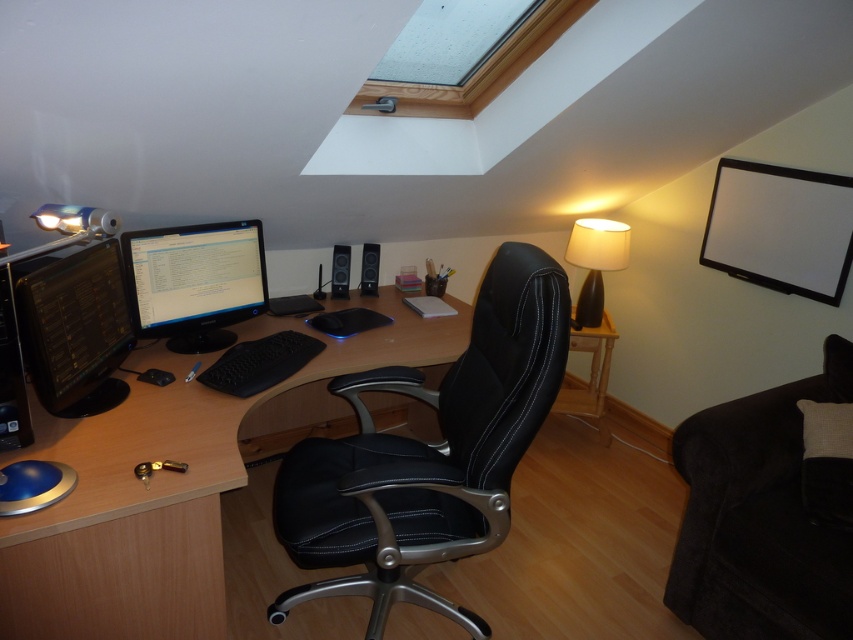
You are a delivery person who needs to place a package on the desk in the home office. The desk is at position 0.811, 0.891. Where should you place the package so that it is directly in front of the black leather swivel chair at center?

The package should be placed directly in front of the black leather swivel chair at center, which is located at position (759, 518). Since the chair is already at that coordinate, the package should be placed on the desk near the chair at that position.

You are standing in the loft office and need to place a new monitor on the woodendesk at center. According to the 2D coordinates provided, where exactly should you position it?

The woodendesk at center is located at the 2D coordinates point (172, 484), so you should position the new monitor there.